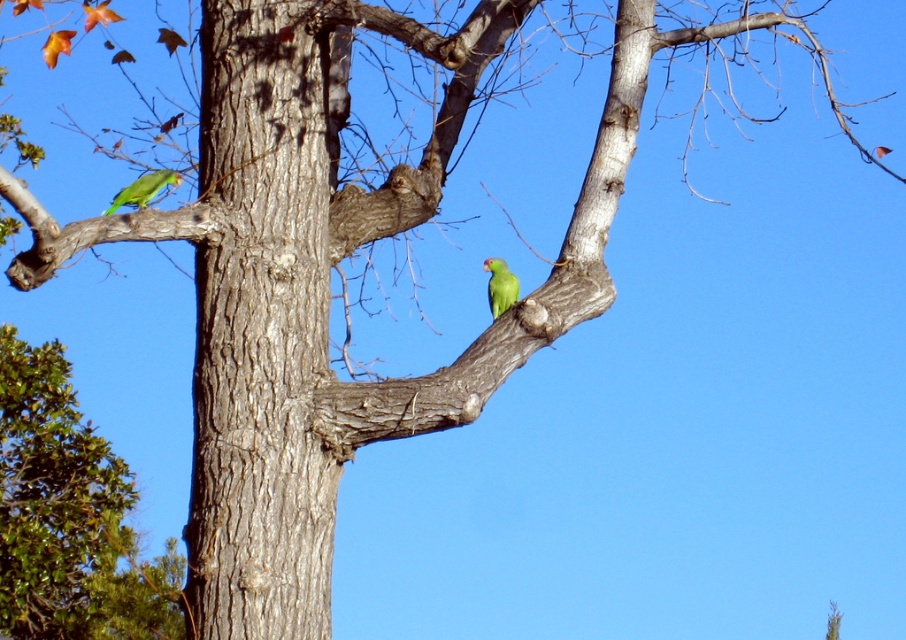
Does smooth bark tree trunk at center have a lesser width compared to green matte parrot at center?

In fact, smooth bark tree trunk at center might be wider than green matte parrot at center.

Can you confirm if smooth bark tree trunk at center is positioned to the right of green matte parrot at center?

In fact, smooth bark tree trunk at center is to the left of green matte parrot at center.

Is point (324, 589) less distant than point (494, 298)?

Yes, point (324, 589) is closer to viewer.

At what (x,y) coordinates should I click in order to perform the action: click on smooth bark tree trunk at center. Please return your answer as a coordinate pair (x, y). The height and width of the screenshot is (640, 906). Looking at the image, I should click on (261, 326).

Between smooth bark tree trunk at center and green matte parrot at left, which one is positioned lower?

smooth bark tree trunk at center is below.

Between smooth bark tree trunk at center and green matte parrot at left, which one is positioned higher?

Positioned higher is green matte parrot at left.

Is point (283, 131) in front of point (133, 192)?

Yes, point (283, 131) is closer to viewer.

In order to click on smooth bark tree trunk at center in this screenshot , I will do `click(261, 326)`.

Does green matte parrot at left have a lesser width compared to green matte parrot at center?

No.

Who is lower down, green matte parrot at left or green matte parrot at center?

green matte parrot at center

This screenshot has height=640, width=906. What do you see at coordinates (143, 188) in the screenshot?
I see `green matte parrot at left` at bounding box center [143, 188].

You are a GUI agent. You are given a task and a screenshot of the screen. Output one action in this format:
    pyautogui.click(x=<x>, y=<y>)
    Task: Click on the green matte parrot at left
    This screenshot has height=640, width=906.
    Given the screenshot: What is the action you would take?
    (143, 188)